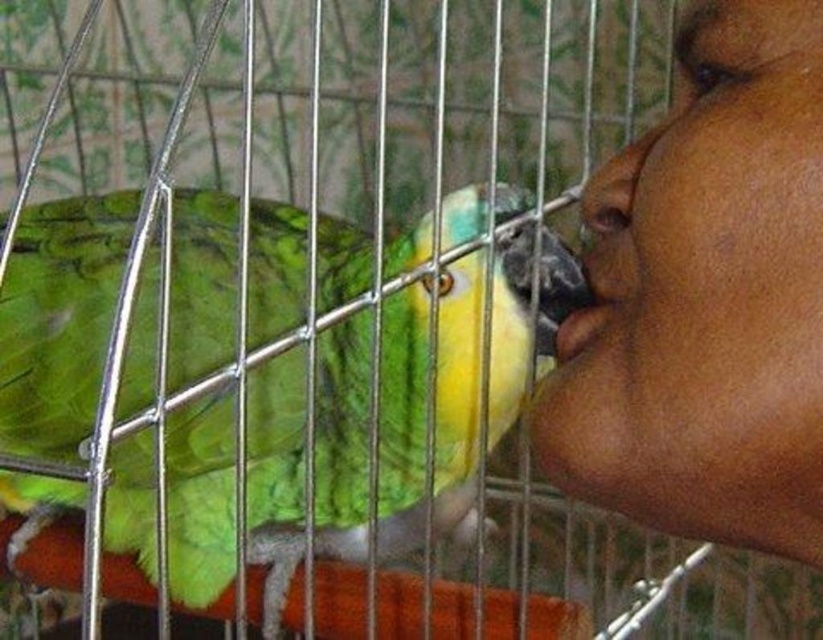
You are a photographer trying to capture a closeup of the green feathered parrot at left and the smooth skin face at upper right in the scene. Which object should you focus on first if you want to ensure both are in focus without adjusting the camera settings?

The green feathered parrot at left is bigger than the smooth skin face at upper right, so focusing on the green feathered parrot at left first would help ensure both are in focus since it is larger and requires more detailed focus.

You are a photographer trying to capture the interaction between the person and the parrot. You notice the smooth skin face at upper right and the smooth skin at mouth right. Which part of the person is more to the right side?

The smooth skin face at upper right is more to the right side than the smooth skin at mouth right.

You are a photographer trying to capture a close shot of the green feathered parrot at left and the matte skin nose at right in the image. Which object should you focus on first to ensure both are in focus?

You should focus on the green feathered parrot at left first because it is closer to the viewer than the matte skin nose at right, so focusing on the closer object will help ensure both are in focus.